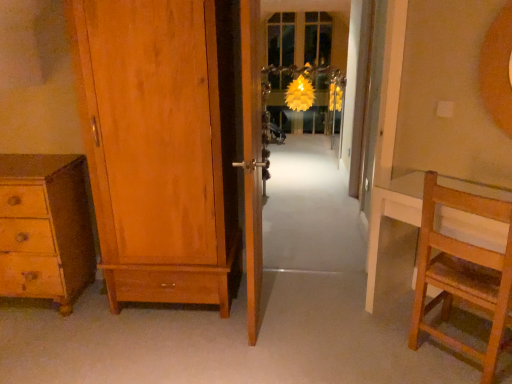
Locate an element on the screen. The image size is (512, 384). vacant space underneath light brown wooden chair at right (from a real-world perspective) is located at coordinates (451, 357).